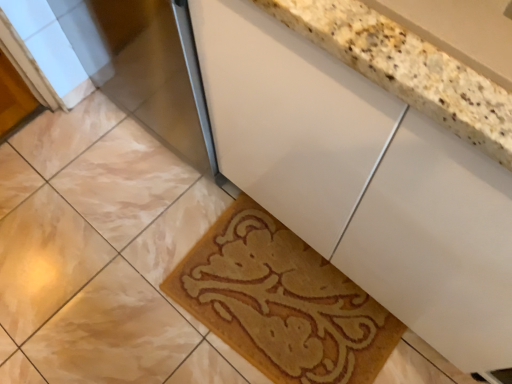
Question: Is marble tile at lower left wider or thinner than white glossy cabinet at center?

Choices:
 (A) wide
 (B) thin

Answer: (B)

Question: In the image, is marble tile at lower left on the left side or the right side of white glossy cabinet at center?

Choices:
 (A) left
 (B) right

Answer: (A)

Question: Which object is positioned farthest from the beige textured bath mat at lower center?

Choices:
 (A) white glossy cabinet at center
 (B) marble tile at lower left

Answer: (B)

Question: Estimate the real-world distances between objects in this image. Which object is farther from the marble tile at lower left?

Choices:
 (A) white glossy cabinet at center
 (B) beige textured bath mat at lower center

Answer: (A)